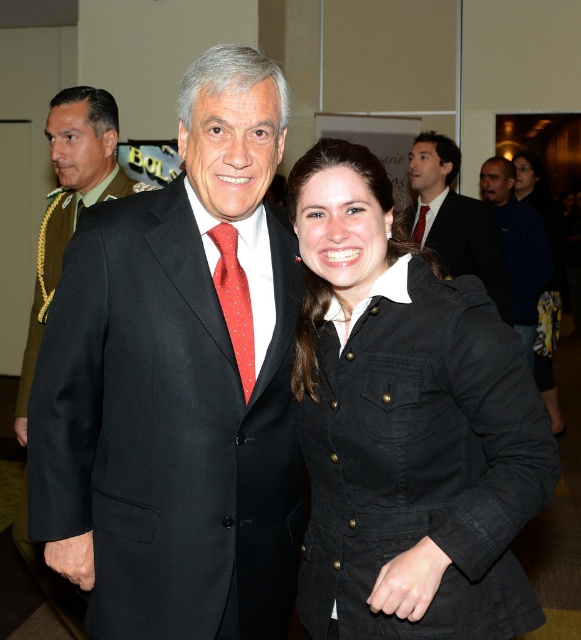
Is the position of black matte jacket at center more distant than that of matte black suit at center?

That is False.

Between black matte jacket at center and matte black suit at center, which one is positioned lower?

black matte jacket at center

Does point (349, 403) lie behind point (120, 184)?

That is False.

At what (x,y) coordinates should I click in order to perform the action: click on black matte jacket at center. Please return your answer as a coordinate pair (x, y). The image size is (581, 640). Looking at the image, I should click on (407, 426).

Which is in front, point (374, 588) or point (414, 243)?

Positioned in front is point (374, 588).

Measure the distance between point [505,422] and camera.

Point [505,422] is 4.22 feet away from camera.

Which is behind, point (536, 461) or point (426, 204)?

Point (426, 204)

Identify the location of black matte jacket at center. (407, 426).

Who is more distant from viewer, (123, 564) or (71, 150)?

The point (71, 150) is behind.

Does point (243, 422) lie in front of point (95, 141)?

Yes, point (243, 422) is in front of point (95, 141).

I want to click on black wool suit at center, so click(166, 429).